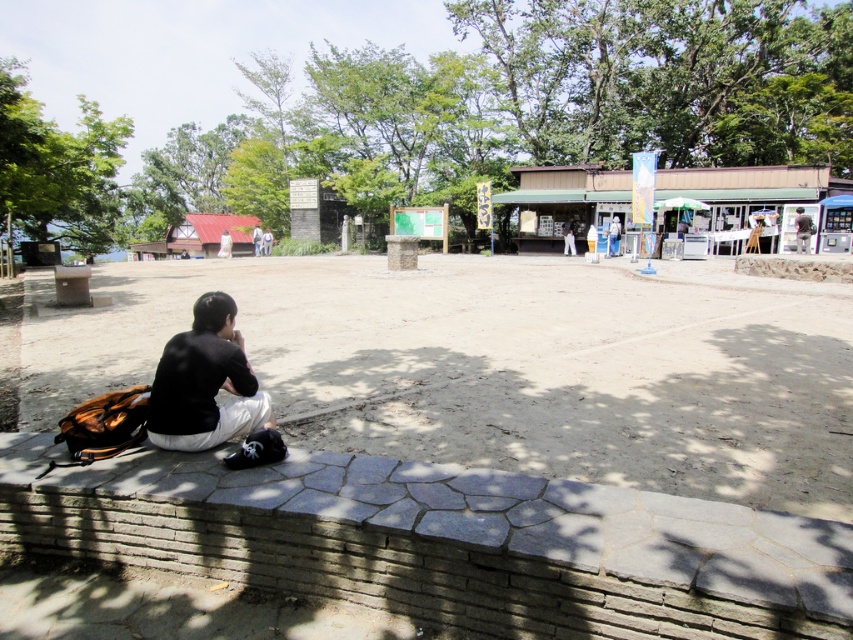
You are a photographer setting up a tripod in this park scene. You need to place your equipment on the ground near the brick at lower left and the black matte shirt at lower left. Which object should you choose to ensure your tripod has enough space?

The brick at lower left has a larger size compared to the black matte shirt at lower left, so you should place your tripod on the brick at lower left to ensure enough space.

You are standing at the point labeled as point (811, 221) and want to walk towards the person sitting on the stone wall. Which direction should you move relative to point (426, 602)?

You should move towards point (426, 602) because it is in front of point (811, 221), so moving towards it would lead you closer to the person on the stone wall.